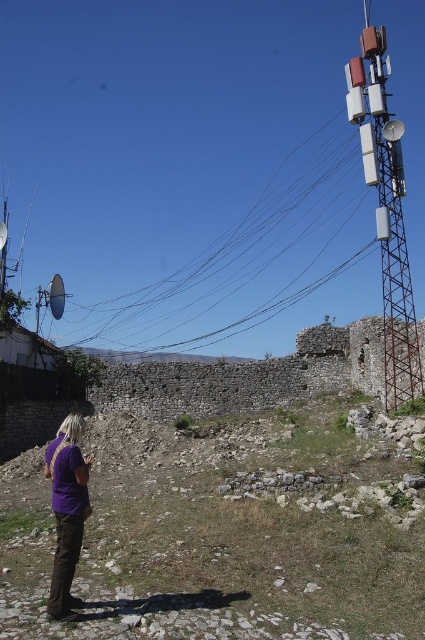
Between gravelly stone hillside at lower center and purple cotton shirt at lower left, which one appears on the right side from the viewer's perspective?

gravelly stone hillside at lower center is more to the right.

Consider the image. How distant is gravelly stone hillside at lower center from purple cotton shirt at lower left?

gravelly stone hillside at lower center is 18.25 meters away from purple cotton shirt at lower left.

The image size is (425, 640). What do you see at coordinates (226, 532) in the screenshot?
I see `gravelly stone hillside at lower center` at bounding box center [226, 532].

Locate an element on the screen. gravelly stone hillside at lower center is located at coordinates (226, 532).

Is point (161, 333) farther from viewer compared to point (368, 84)?

Yes, point (161, 333) is farther from viewer.

Does point (210, 268) come farther from viewer compared to point (380, 160)?

That is True.

Locate an element on the screen. black wire at upper right is located at coordinates (226, 268).

Between black wire at upper right and purple cotton shirt at lower left, which one appears on the left side from the viewer's perspective?

From the viewer's perspective, purple cotton shirt at lower left appears more on the left side.

How distant is black wire at upper right from purple cotton shirt at lower left?

black wire at upper right and purple cotton shirt at lower left are 115.30 meters apart.

Locate an element on the screen. The width and height of the screenshot is (425, 640). black wire at upper right is located at coordinates (226, 268).